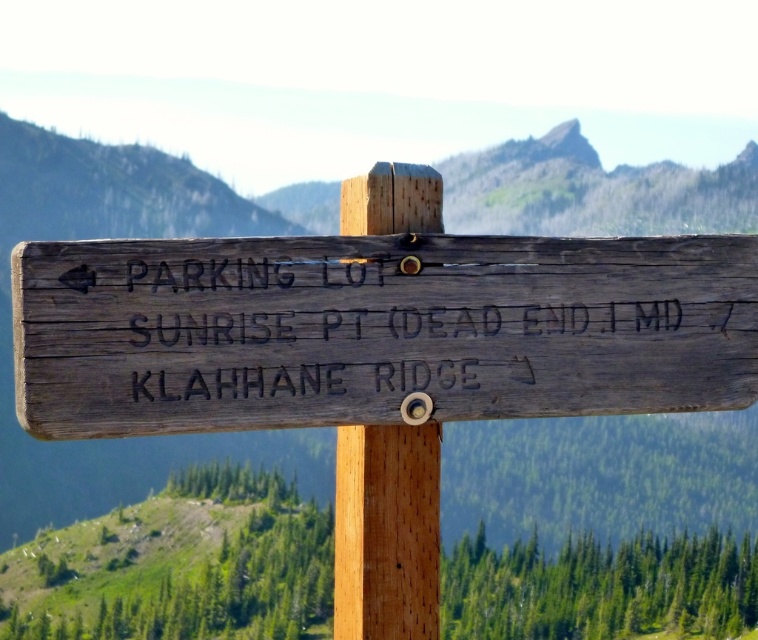
Who is lower down, weathered wood sign at center or smooth gray rock at upper center?

Positioned lower is weathered wood sign at center.

Identify the location of weathered wood sign at center. This screenshot has width=758, height=640. (376, 330).

Between wooden post at center and smooth gray rock at upper center, which one has less height?

Standing shorter between the two is smooth gray rock at upper center.

This screenshot has width=758, height=640. I want to click on wooden post at center, so click(387, 532).

Between weathered wood sign at center and wooden post at center, which one appears on the left side from the viewer's perspective?

From the viewer's perspective, wooden post at center appears more on the left side.

Does weathered wood sign at center appear on the left side of wooden post at center?

Incorrect, weathered wood sign at center is not on the left side of wooden post at center.

At what (x,y) coordinates should I click in order to perform the action: click on weathered wood sign at center. Please return your answer as a coordinate pair (x, y). Image resolution: width=758 pixels, height=640 pixels. Looking at the image, I should click on (376, 330).